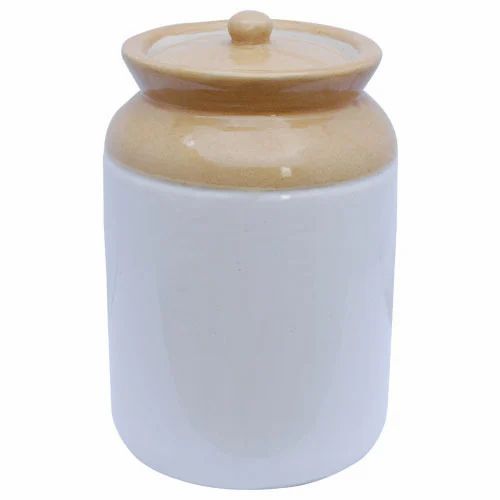
Locate an element on the screen. The image size is (500, 500). off white jar reflection is located at coordinates (294, 306).